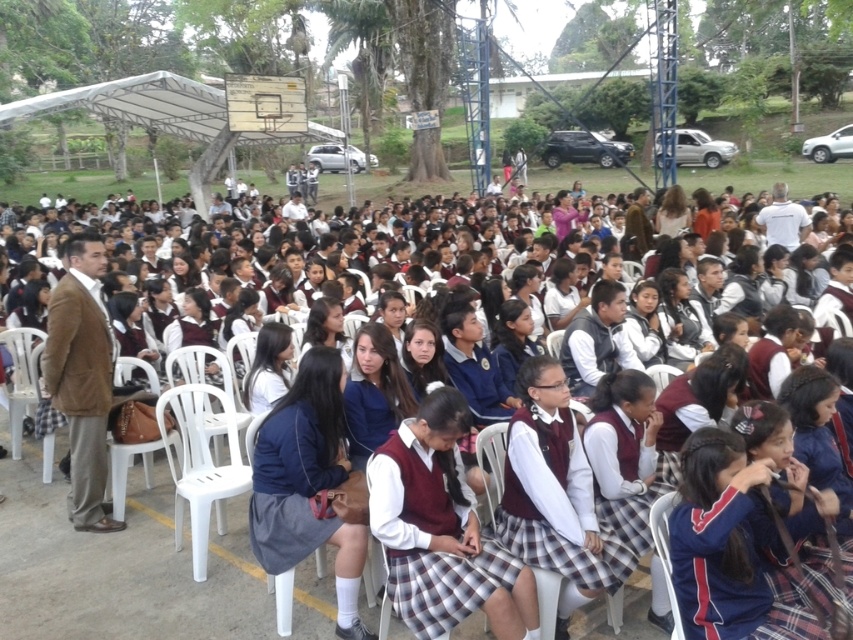
Does white plastic chair at center come behind white plastic chair at lower right?

That is True.

Which of these two, white plastic chair at center or white plastic chair at lower right, stands shorter?

white plastic chair at lower right is shorter.

Which is in front, point (198, 401) or point (674, 636)?

Point (674, 636) is in front.

Where is `white plastic chair at center`? The height and width of the screenshot is (640, 853). white plastic chair at center is located at coordinates (200, 465).

Between maroon uniformed students at center and white plastic chair at center, which one has more height?

white plastic chair at center is taller.

Between point (144, 624) and point (196, 556), which one is positioned in front?

Point (144, 624) is more forward.

This screenshot has width=853, height=640. I want to click on maroon uniformed students at center, so click(x=120, y=564).

Between maroon uniformed students at center and white plastic chair at lower right, which one has more height?

Standing taller between the two is white plastic chair at lower right.

Who is higher up, maroon uniformed students at center or white plastic chair at lower right?

Positioned higher is white plastic chair at lower right.

Where is `maroon uniformed students at center`? maroon uniformed students at center is located at coordinates (120, 564).